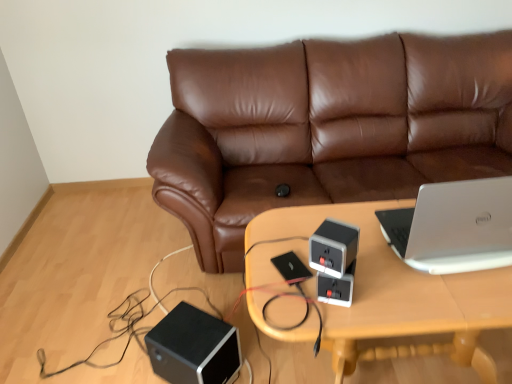
Image resolution: width=512 pixels, height=384 pixels. Find the location of `vacant region to the left of silver metallic laptop at right`. vacant region to the left of silver metallic laptop at right is located at coordinates (356, 252).